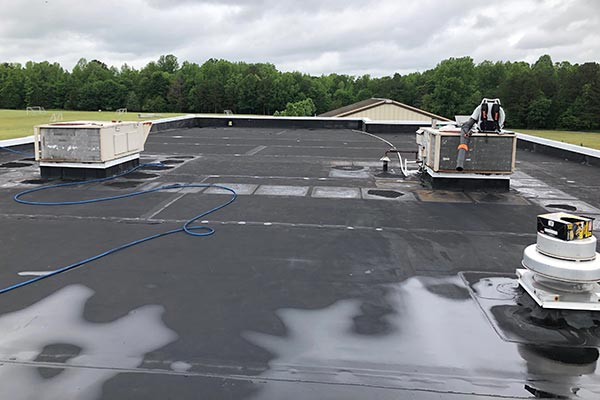
Where is `object on top of ventilation system`? object on top of ventilation system is located at coordinates (484, 118).